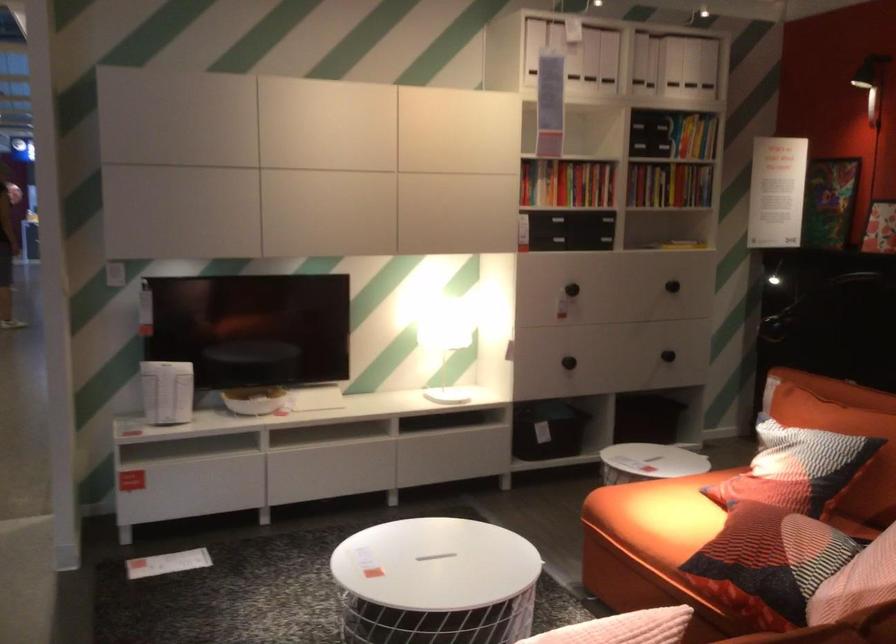
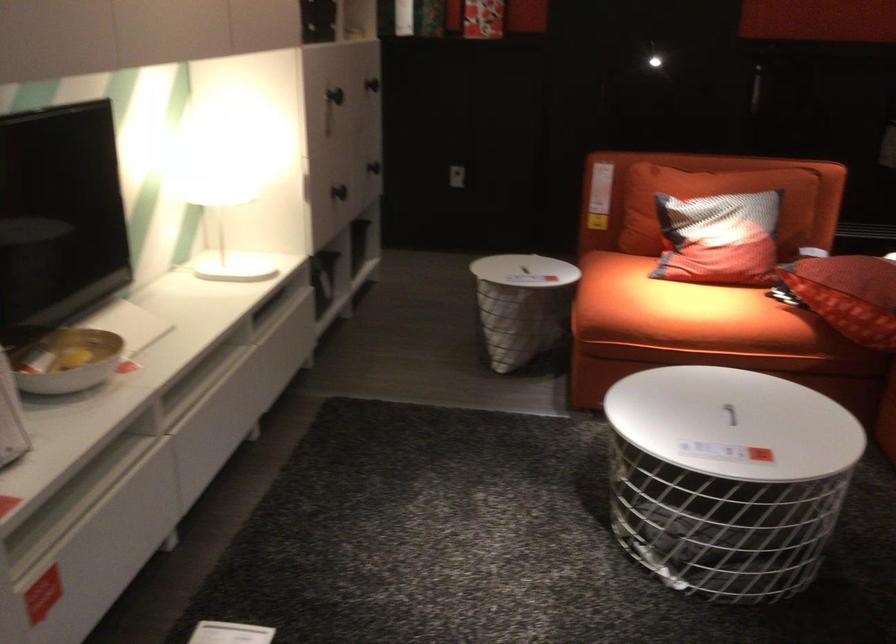
Find the pixel in the second image that matches (584,274) in the first image.

(334, 95)